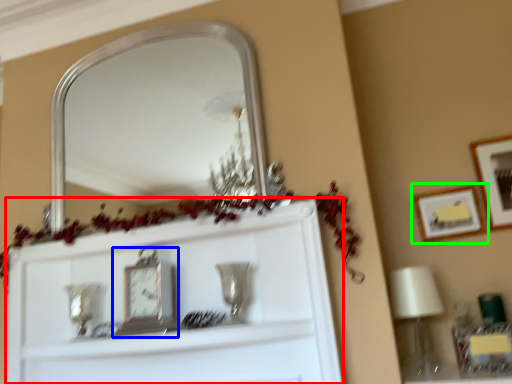
Question: Based on their relative distances, which object is farther from cabinet (highlighted by a red box)? Choose from clock (highlighted by a blue box) and picture frame (highlighted by a green box).

Choices:
 (A) clock
 (B) picture frame

Answer: (B)